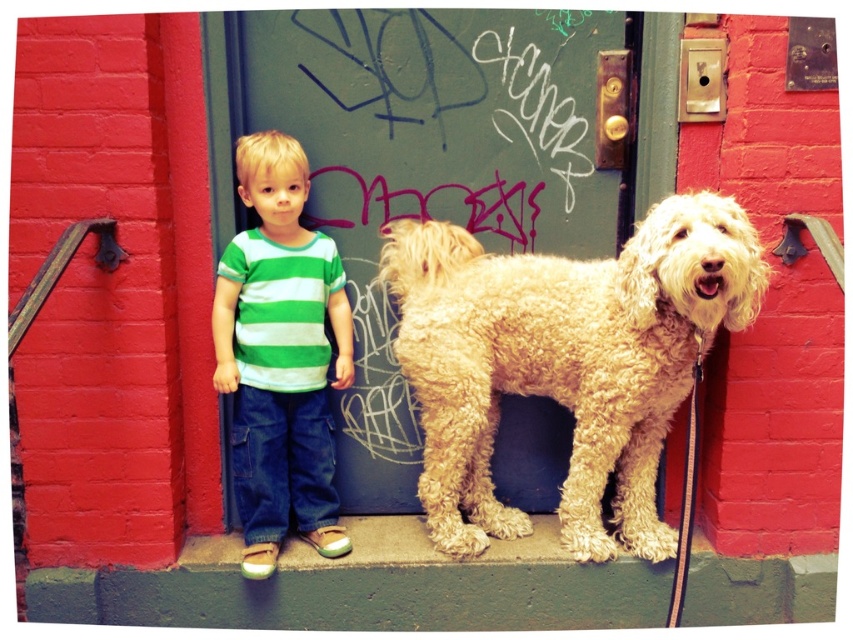
You are a delivery person trying to enter the house through the green painted wood door at center. There is a golden curly fur dog at center blocking your path. Can you walk through the door without moving the dog?

The golden curly fur dog at center is behind the green painted wood door at center, so you can walk through the green painted wood door at center without moving the dog because the dog is already behind the door.

You are taking a photo of the child and the dog. The camera is at your eye level. You want to focus on the point closer to you. Which point should you focus on, point (708, 221) or point (331, 320)?

Point (708, 221) is closer to the camera than point (331, 320), so you should focus on point (708, 221).

You are a painter who wants to paint a mural on the green painted wood door at center and the golden curly fur dog at center. Which object requires a taller ladder to reach its top?

The green painted wood door at center is taller than the golden curly fur dog at center, so you need a taller ladder for the green painted wood door at center.